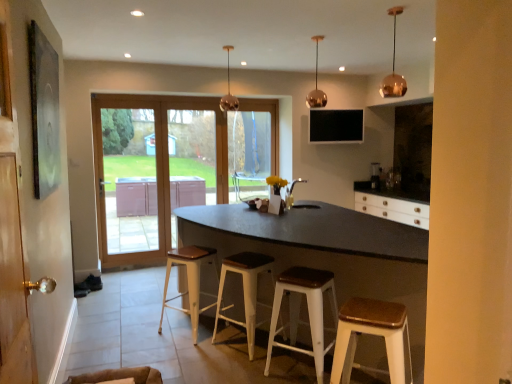
Locate an element on the screen. The width and height of the screenshot is (512, 384). free space above white wood stool at lower right, placed as the 1th stool when sorted from front to back (from a real-world perspective) is located at coordinates (370, 306).